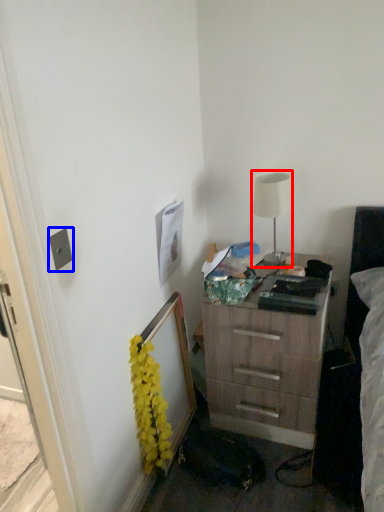
Question: Which of the following is the farthest to the observer, table lamp (highlighted by a red box) or electric outlet (highlighted by a blue box)?

Choices:
 (A) table lamp
 (B) electric outlet

Answer: (A)